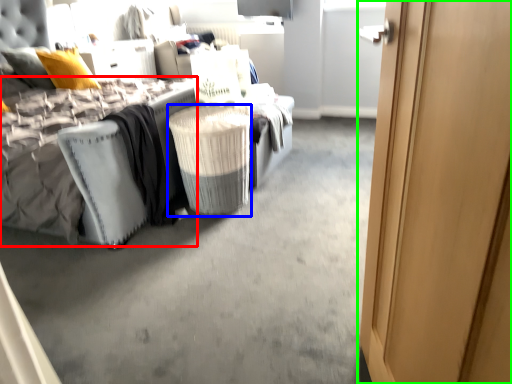
Question: Considering the real-world distances, which object is closest to mattress (highlighted by a red box)? laundry basket (highlighted by a blue box) or door (highlighted by a green box).

Choices:
 (A) laundry basket
 (B) door

Answer: (A)